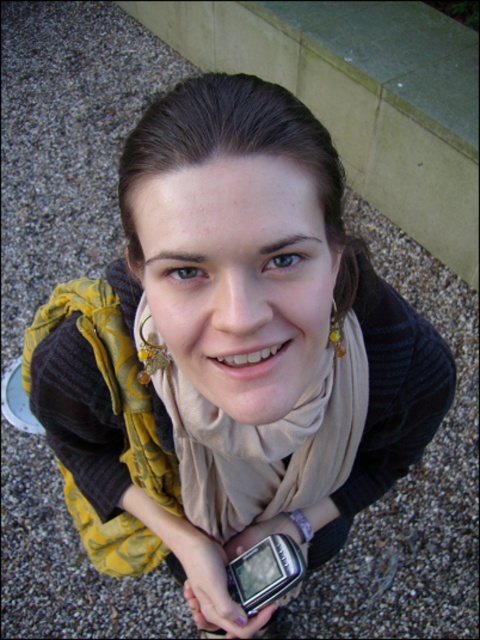
Question: Which of the following is the farthest from the observer?

Choices:
 (A) pos(190,605)
 (B) pos(229,448)

Answer: (A)

Question: Is beige soft scarf at center below matte plastic phone at lower center?

Choices:
 (A) no
 (B) yes

Answer: (A)

Question: Does beige soft scarf at center have a larger size compared to matte plastic phone at lower center?

Choices:
 (A) yes
 (B) no

Answer: (A)

Question: Is beige soft scarf at center thinner than matte plastic phone at lower center?

Choices:
 (A) no
 (B) yes

Answer: (A)